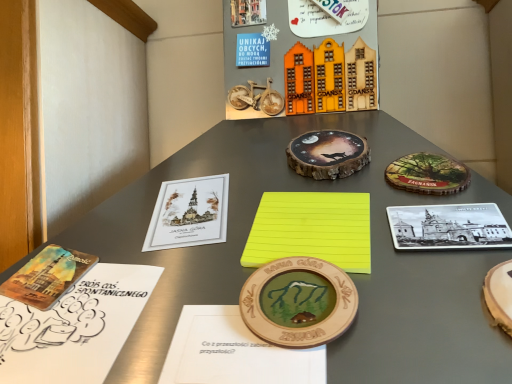
The height and width of the screenshot is (384, 512). In order to click on yellow paper at center, acting as the third notebook starting from the left in this screenshot , I will do `click(311, 229)`.

This screenshot has height=384, width=512. Describe the element at coordinates (311, 229) in the screenshot. I see `yellow paper at center, acting as the third notebook starting from the left` at that location.

Describe the element at coordinates (75, 327) in the screenshot. Image resolution: width=512 pixels, height=384 pixels. I see `white paper notebook at lower left, acting as the third notebook starting from the right` at that location.

Image resolution: width=512 pixels, height=384 pixels. I want to click on white paper notebook at lower left, acting as the third notebook starting from the right, so click(75, 327).

What do you see at coordinates (449, 226) in the screenshot?
I see `black and white ceramic plate at upper right, which is the third book from left to right` at bounding box center [449, 226].

What do you see at coordinates (189, 213) in the screenshot?
I see `matte paper book at center left, the second book when ordered from right to left` at bounding box center [189, 213].

Locate an element on the screen. The image size is (512, 384). watercolor paper book at lower left, arranged as the 1th book when viewed from the left is located at coordinates (48, 276).

Can you confirm if yellow matte paper at center is bigger than black and white ceramic plate at upper right, which is the third book from left to right?

Indeed, yellow matte paper at center has a larger size compared to black and white ceramic plate at upper right, which is the third book from left to right.

From the picture: From the image's perspective, is yellow matte paper at center located above or below black and white ceramic plate at upper right, which is the third book from left to right?

yellow matte paper at center is above black and white ceramic plate at upper right, which is the third book from left to right.

Is yellow matte paper at center behind black and white ceramic plate at upper right, positioned as the first book in right-to-left order?

No.

Is yellow matte paper at center turned away from black and white ceramic plate at upper right, which is the third book from left to right?

That's not correct — yellow matte paper at center is not looking away from black and white ceramic plate at upper right, which is the third book from left to right.

Is watercolor paper book at lower left, arranged as the 1th book when viewed from the left, facing away from black and white ceramic plate at upper right, which is the third book from left to right?

No, watercolor paper book at lower left, arranged as the 1th book when viewed from the left, is not facing the opposite direction of black and white ceramic plate at upper right, which is the third book from left to right.

Looking at the image, does watercolor paper book at lower left, the third book viewed from the right, seem bigger or smaller compared to black and white ceramic plate at upper right, which is the third book from left to right?

In the image, watercolor paper book at lower left, the third book viewed from the right, appears to be smaller than black and white ceramic plate at upper right, which is the third book from left to right.

Does watercolor paper book at lower left, arranged as the 1th book when viewed from the left, lie behind black and white ceramic plate at upper right, positioned as the first book in right-to-left order?

Yes, watercolor paper book at lower left, arranged as the 1th book when viewed from the left, is further from the viewer.

From a real-world perspective, is watercolor paper book at lower left, arranged as the 1th book when viewed from the left, physically located above or below black and white ceramic plate at upper right, which is the third book from left to right?

watercolor paper book at lower left, arranged as the 1th book when viewed from the left, is below black and white ceramic plate at upper right, which is the third book from left to right.

Is point (37, 282) more distant than point (162, 221)?

No, (37, 282) is closer to viewer.

From the picture: Does watercolor paper book at lower left, arranged as the 1th book when viewed from the left, have a smaller size compared to matte paper book at center left, the second book when ordered from right to left?

Yes.

Is watercolor paper book at lower left, arranged as the 1th book when viewed from the left, wider or thinner than matte paper book at center left, placed as the second book when sorted from left to right?

In the image, watercolor paper book at lower left, arranged as the 1th book when viewed from the left, appears to be more narrow than matte paper book at center left, placed as the second book when sorted from left to right.

Consider the image. From their relative heights in the image, would you say watercolor paper book at lower left, arranged as the 1th book when viewed from the left, is taller or shorter than matte paper book at center left, placed as the second book when sorted from left to right?

watercolor paper book at lower left, arranged as the 1th book when viewed from the left, is shorter than matte paper book at center left, placed as the second book when sorted from left to right.

Could you tell me if wooden medallion at center, acting as the second coin starting from the back, is facing wooden toy houses at upper center?

No, wooden medallion at center, acting as the second coin starting from the back, is not aimed at wooden toy houses at upper center.

Is wooden medallion at center, acting as the second coin starting from the back, next to wooden toy houses at upper center?

wooden medallion at center, acting as the second coin starting from the back, is not next to wooden toy houses at upper center, and they're not touching.

Which is behind, point (282, 286) or point (345, 80)?

The point (345, 80) is farther.

Is point (318, 171) farther from camera compared to point (163, 207)?

Yes.

Considering the relative sizes of wooden coaster at center, the second coin in the front-to-back sequence, and matte paper book at center left, placed as the second book when sorted from left to right, in the image provided, is wooden coaster at center, the second coin in the front-to-back sequence, thinner than matte paper book at center left, placed as the second book when sorted from left to right,?

Yes.

Consider the image. Is matte paper book at center left, placed as the second book when sorted from left to right, completely or partially inside wooden coaster at center, the 1th coin when ordered from back to front?

That's incorrect, matte paper book at center left, placed as the second book when sorted from left to right, is not inside wooden coaster at center, the 1th coin when ordered from back to front.

Which object is further away from the camera, wooden coaster at center, the second coin in the front-to-back sequence, or matte paper book at center left, placed as the second book when sorted from left to right?

Positioned behind is wooden coaster at center, the second coin in the front-to-back sequence.

From the picture: Is matte paper book at center left, placed as the second book when sorted from left to right, positioned with its back to yellow paper at center, acting as the third notebook starting from the left?

matte paper book at center left, placed as the second book when sorted from left to right, is not turned away from yellow paper at center, acting as the third notebook starting from the left.

Where is `the 2nd book above the yellow paper at center, arranged as the 1th notebook when viewed from the right (from the image's perspective)`? the 2nd book above the yellow paper at center, arranged as the 1th notebook when viewed from the right (from the image's perspective) is located at coordinates (189, 213).

Is matte paper book at center left, the second book when ordered from right to left, taller or shorter than yellow paper at center, acting as the third notebook starting from the left?

matte paper book at center left, the second book when ordered from right to left, is taller than yellow paper at center, acting as the third notebook starting from the left.

Which object is positioned more to the left, matte paper book at center left, the second book when ordered from right to left, or yellow paper at center, acting as the third notebook starting from the left?

From the viewer's perspective, matte paper book at center left, the second book when ordered from right to left, appears more on the left side.

Considering the sizes of matte paper book at center left, the second book when ordered from right to left, and yellow matte paper at center in the image, is matte paper book at center left, the second book when ordered from right to left, taller or shorter than yellow matte paper at center?

In the image, matte paper book at center left, the second book when ordered from right to left, appears to be shorter than yellow matte paper at center.

From the image's perspective, would you say matte paper book at center left, placed as the second book when sorted from left to right, is shown under yellow matte paper at center?

Yes.

Is matte paper book at center left, the second book when ordered from right to left, oriented away from yellow matte paper at center?

Yes, matte paper book at center left, the second book when ordered from right to left, is positioned with its back facing yellow matte paper at center.

Who is more distant, matte paper book at center left, placed as the second book when sorted from left to right, or yellow matte paper at center?

matte paper book at center left, placed as the second book when sorted from left to right, is further from the camera.

You are a GUI agent. You are given a task and a screenshot of the screen. Output one action in this format:
    pyautogui.click(x=<x>, y=<y>)
    Task: Click on the table positioned vertically above the black and white ceramic plate at upper right, positioned as the first book in right-to-left order (from a real-world perspective)
    Image resolution: width=512 pixels, height=384 pixels.
    Given the screenshot: What is the action you would take?
    pyautogui.click(x=349, y=274)

There is a watercolor paper book at lower left, arranged as the 1th book when viewed from the left. Identify the location of the 1st book above it (from the image's perspective). (449, 226).

Looking at this image, considering their positions, is yellow matte paper at center positioned further to yellow paper at center, arranged as the 1th notebook when viewed from the right, than black and white ceramic plate at upper right, which is the third book from left to right?

yellow matte paper at center.

Estimate the real-world distances between objects in this image. Which object is closer to black and white ceramic plate at upper right, which is the third book from left to right, watercolor paper book at lower left, the third book viewed from the right, or wooden medallion at center, the second coin from the top?

wooden medallion at center, the second coin from the top.

Based on their spatial positions, is yellow matte paper at center or wooden medallion at center, acting as the second coin starting from the back, closer to watercolor paper book at lower left, the third book viewed from the right?

Based on the image, wooden medallion at center, acting as the second coin starting from the back, appears to be nearer to watercolor paper book at lower left, the third book viewed from the right.

Considering their positions, is yellow paper at center, arranged as the 1th notebook when viewed from the right, positioned closer to white paper notebook at lower left, the 1th notebook when ordered from left to right, than wooden toy houses at upper center?

Result: Among the two, yellow paper at center, arranged as the 1th notebook when viewed from the right, is located nearer to white paper notebook at lower left, the 1th notebook when ordered from left to right.

Considering their positions, is black and white ceramic plate at upper right, positioned as the first book in right-to-left order, positioned closer to wooden medallion at center, acting as the second coin starting from the back, than wooden coaster at center, the second coin in the front-to-back sequence?

black and white ceramic plate at upper right, positioned as the first book in right-to-left order, is positioned closer to the anchor wooden medallion at center, acting as the second coin starting from the back.

When comparing their distances from yellow paper at center, acting as the third notebook starting from the left, does matte paper book at center left, placed as the second book when sorted from left to right, or white paper notebook at lower left, acting as the third notebook starting from the right, seem closer?

matte paper book at center left, placed as the second book when sorted from left to right, lies closer to yellow paper at center, acting as the third notebook starting from the left, than the other object.

When comparing their distances from wooden medallion at center, the second coin from the top, does white paper notebook at lower left, acting as the third notebook starting from the right, or wooden notebook at center, placed as the second notebook when sorted from left to right, seem closer?

Among the two, wooden notebook at center, placed as the second notebook when sorted from left to right, is located nearer to wooden medallion at center, the second coin from the top.

Estimate the real-world distances between objects in this image. Which object is closer to matte paper book at center left, placed as the second book when sorted from left to right, yellow matte paper at center or yellow paper at center, acting as the third notebook starting from the left?

yellow paper at center, acting as the third notebook starting from the left, is closer to matte paper book at center left, placed as the second book when sorted from left to right.

Locate an element on the screen. The width and height of the screenshot is (512, 384). coin between watercolor paper book at lower left, arranged as the 1th book when viewed from the left, and wooden coaster at center, the second coin in the front-to-back sequence is located at coordinates (298, 302).

The height and width of the screenshot is (384, 512). What are the coordinates of `notebook located between white paper notebook at lower left, acting as the third notebook starting from the right, and yellow paper at center, arranged as the 1th notebook when viewed from the right, in the left-right direction` in the screenshot? It's located at (233, 352).

I want to click on book located between watercolor paper book at lower left, the third book viewed from the right, and yellow paper at center, arranged as the 1th notebook when viewed from the right, in the left-right direction, so click(x=189, y=213).

The width and height of the screenshot is (512, 384). In order to click on table between matte paper book at center left, placed as the second book when sorted from left to right, and black and white ceramic plate at upper right, which is the third book from left to right, from left to right in this screenshot , I will do `click(349, 274)`.